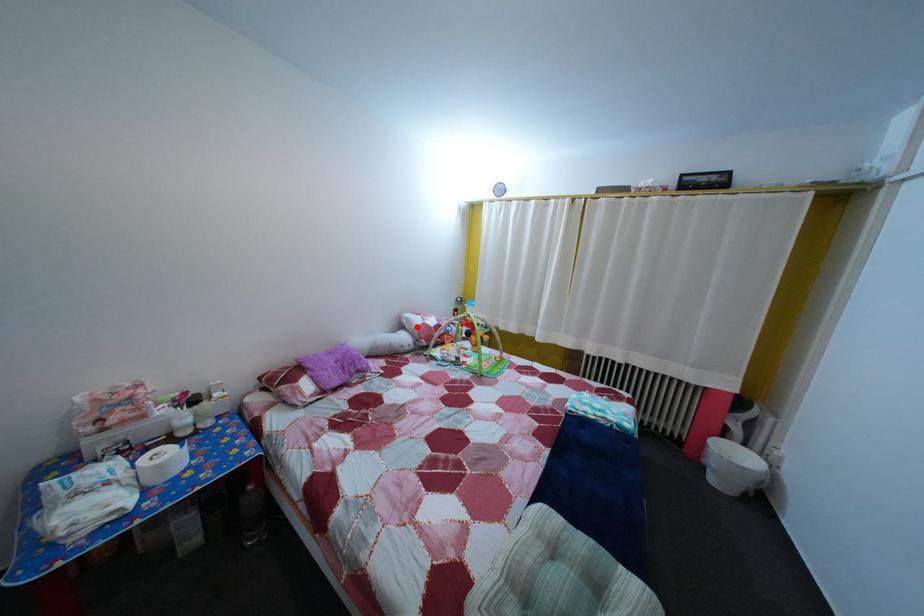
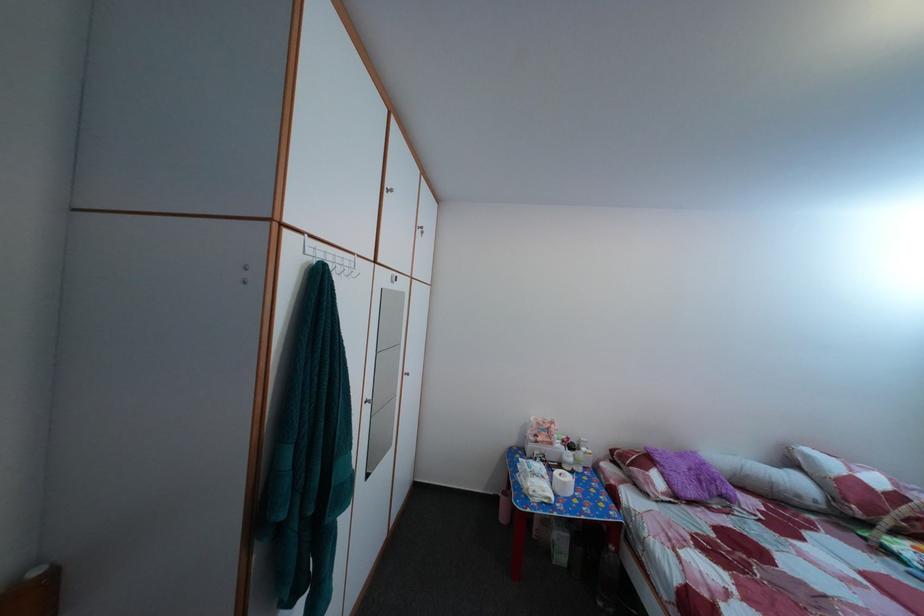
Find the pixel in the second image that matches the highlighted location in the first image.

(817, 464)